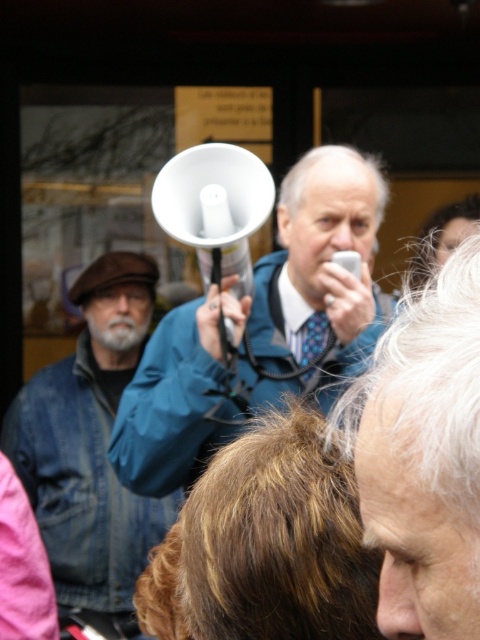
You are a photographer standing in front of the crowd. You want to take a photo of the white plastic megaphone at center and the denim jacket at left. Which object will appear larger in your photo?

The white plastic megaphone at center will appear larger in the photo because it is closer to the viewer than the denim jacket at left.

From the picture: You are a photographer standing 10 feet away from the two men at the center of the scene. You want to take a photo that includes both the white plastic megaphone at center and the smooth blue jacket at center without any part of them being cut off. What is the minimum width of your camera lens in feet to capture both objects in the frame?

The white plastic megaphone at center is 5.44 feet from the smooth blue jacket at center. To capture both objects without any part being cut off, the camera lens must be at least 5.44 feet wide.